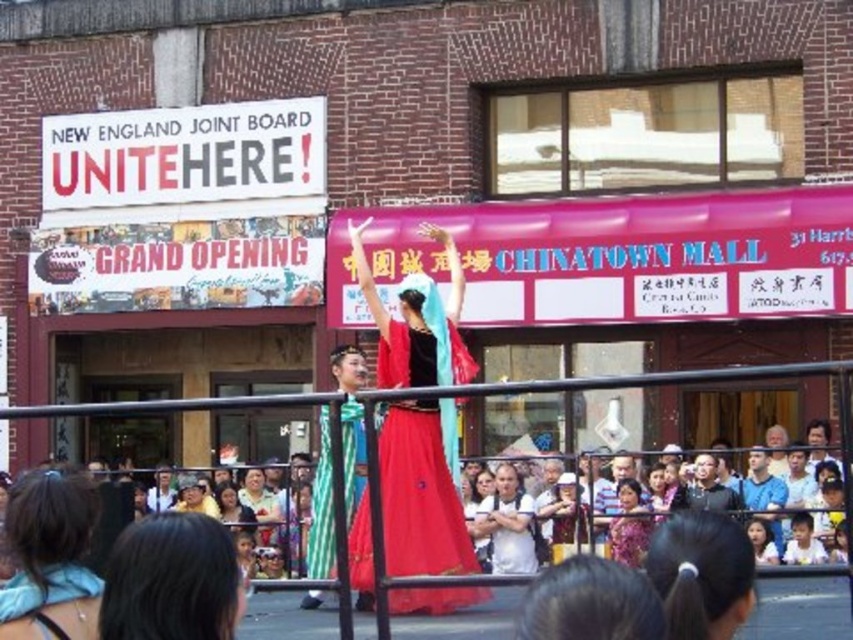
Question: Which point is farther to the camera?

Choices:
 (A) (354, 404)
 (B) (62, 141)

Answer: (B)

Question: From the image, what is the correct spatial relationship of matte black hair at center in relation to light blue fabric at lower right?

Choices:
 (A) above
 (B) below

Answer: (A)

Question: Is dark brown hair at lower left further to the viewer compared to matte black hair at center?

Choices:
 (A) no
 (B) yes

Answer: (A)

Question: Can you confirm if white paper sign at upper left is positioned below multicolored fabric crowd at center?

Choices:
 (A) no
 (B) yes

Answer: (A)

Question: Which point is closer to the camera taking this photo?

Choices:
 (A) (78, 576)
 (B) (282, 186)
 (C) (358, 422)

Answer: (A)

Question: Which point is closer to the camera?

Choices:
 (A) (773, 596)
 (B) (77, 144)

Answer: (A)